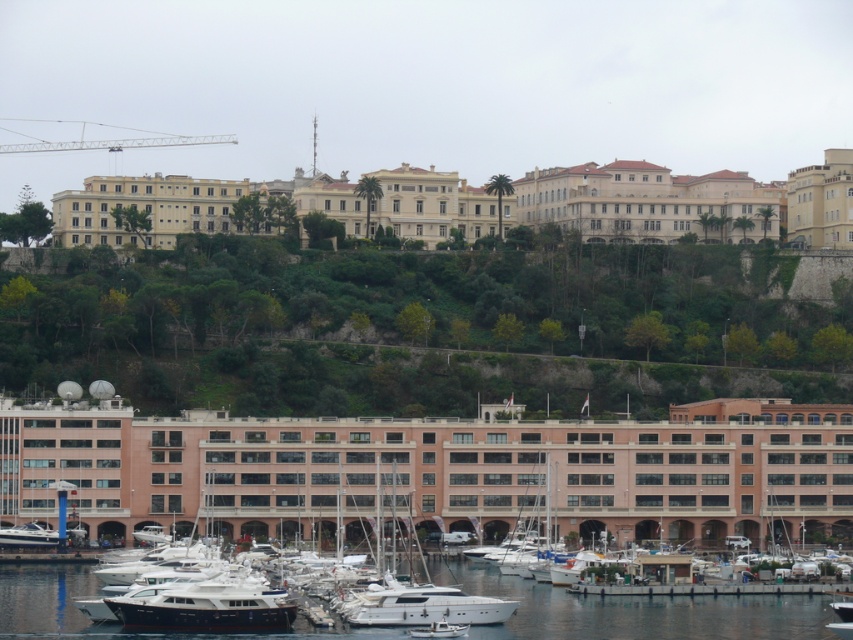
Question: Estimate the real-world distances between objects in this image. Which object is closer to the white glossy boat at lower left?

Choices:
 (A) white glossy yacht at center
 (B) white glossy water at lower center

Answer: (B)

Question: Estimate the real-world distances between objects in this image. Which object is closer to the white glossy water at lower center?

Choices:
 (A) white glossy boat at lower left
 (B) white glossy yacht at center

Answer: (B)

Question: From the image, what is the correct spatial relationship of white glossy water at lower center in relation to white glossy boat at lower left?

Choices:
 (A) left
 (B) right

Answer: (B)

Question: Can you confirm if white glossy water at lower center is positioned above white glossy yacht at center?

Choices:
 (A) yes
 (B) no

Answer: (B)

Question: Can you confirm if white glossy water at lower center is wider than white glossy boat at lower left?

Choices:
 (A) yes
 (B) no

Answer: (A)

Question: Which object appears farthest from the camera in this image?

Choices:
 (A) white glossy boat at lower left
 (B) white glossy water at lower center

Answer: (A)